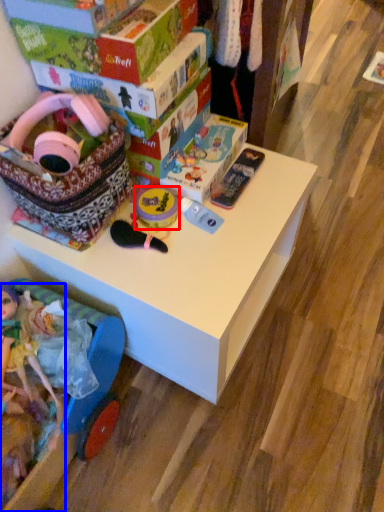
Question: Which object is closer to the camera taking this photo, toy (highlighted by a red box) or toy (highlighted by a blue box)?

Choices:
 (A) toy
 (B) toy

Answer: (B)